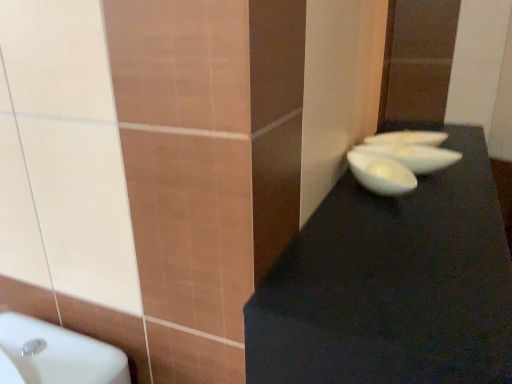
Locate an element on the screen. The height and width of the screenshot is (384, 512). vacant space to the right of white glossy bowl at center, the 2th basin in the back-to-front sequence is located at coordinates (467, 168).